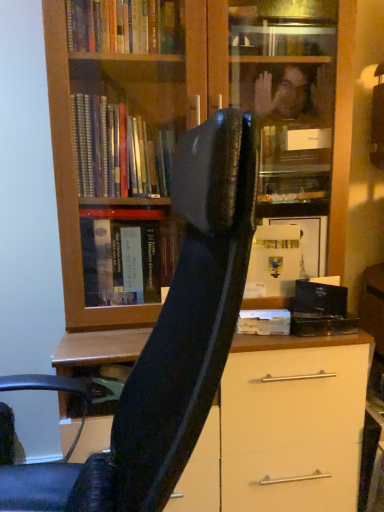
Question: From the image's perspective, does wooden bookcase at center appear lower than white matte paper at center?

Choices:
 (A) yes
 (B) no

Answer: (B)

Question: Is wooden bookcase at center facing towards white matte paper at center?

Choices:
 (A) no
 (B) yes

Answer: (B)

Question: From a real-world perspective, is wooden bookcase at center on top of white matte paper at center?

Choices:
 (A) no
 (B) yes

Answer: (B)

Question: From a real-world perspective, is wooden bookcase at center physically below white matte paper at center?

Choices:
 (A) no
 (B) yes

Answer: (A)

Question: Can you confirm if wooden bookcase at center is taller than white matte paper at center?

Choices:
 (A) yes
 (B) no

Answer: (A)

Question: Is wooden bookcase at center further to camera compared to white matte paper at center?

Choices:
 (A) yes
 (B) no

Answer: (B)

Question: Is white matte paper at center in front of wooden bookcase at center?

Choices:
 (A) no
 (B) yes

Answer: (A)

Question: Considering the relative sizes of white matte paper at center and wooden bookcase at center in the image provided, is white matte paper at center smaller than wooden bookcase at center?

Choices:
 (A) yes
 (B) no

Answer: (A)

Question: Is white matte paper at center taller than wooden bookcase at center?

Choices:
 (A) no
 (B) yes

Answer: (A)

Question: Is there a large distance between white matte paper at center and wooden bookcase at center?

Choices:
 (A) yes
 (B) no

Answer: (B)

Question: Can you confirm if white matte paper at center is bigger than wooden bookcase at center?

Choices:
 (A) yes
 (B) no

Answer: (B)

Question: Could you tell me if white matte paper at center is turned towards wooden bookcase at center?

Choices:
 (A) no
 (B) yes

Answer: (B)

Question: Can you confirm if wooden bookcase at center is shorter than black leather chair at center?

Choices:
 (A) no
 (B) yes

Answer: (A)